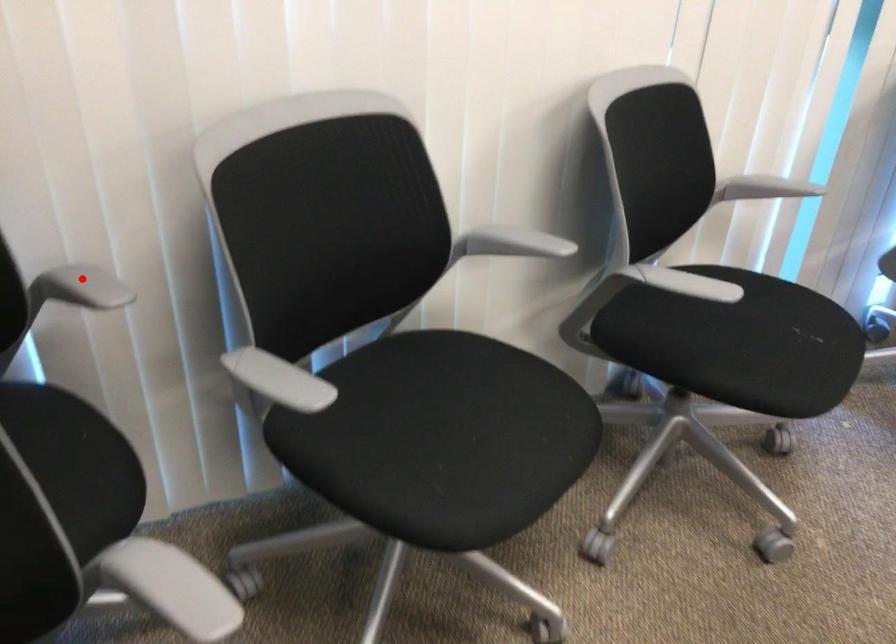
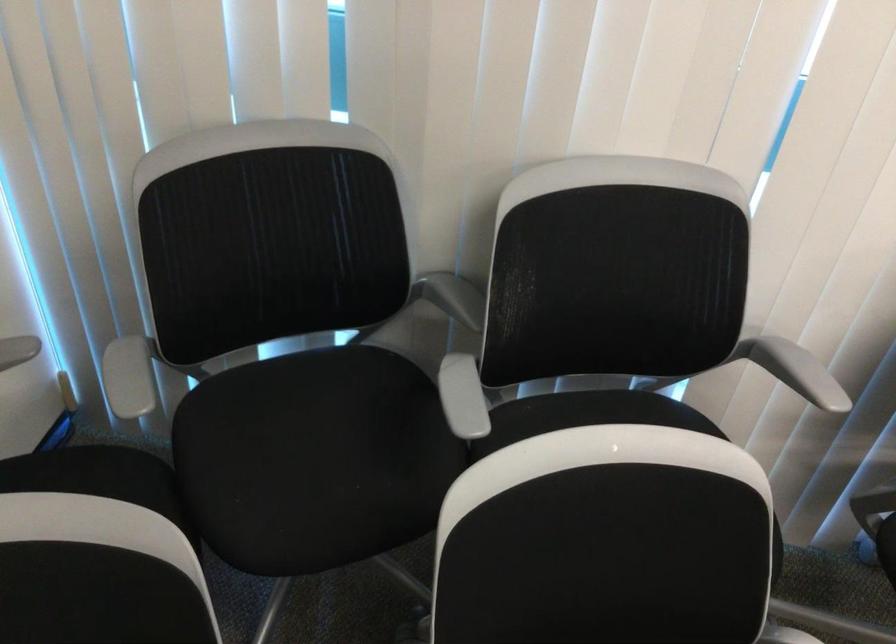
Find the pixel in the second image that matches the highlighted location in the first image.

(794, 370)